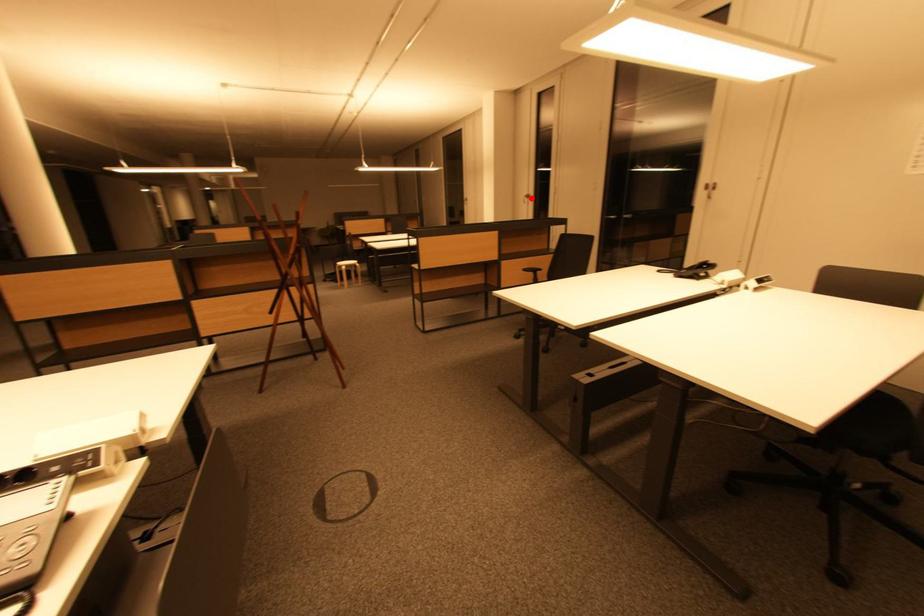
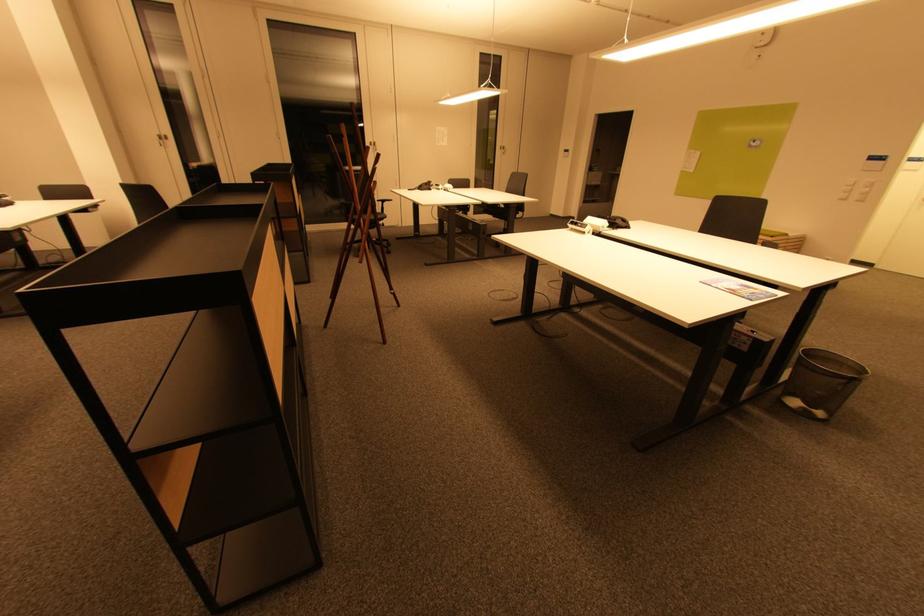
Question: A red point is marked in image1. In image2, is the corresponding 3D point closer to the camera or farther? Reply with the corresponding letter.

Choices:
 (A) The corresponding 3D point is closer.
 (B) The corresponding 3D point is farther.

Answer: (B)